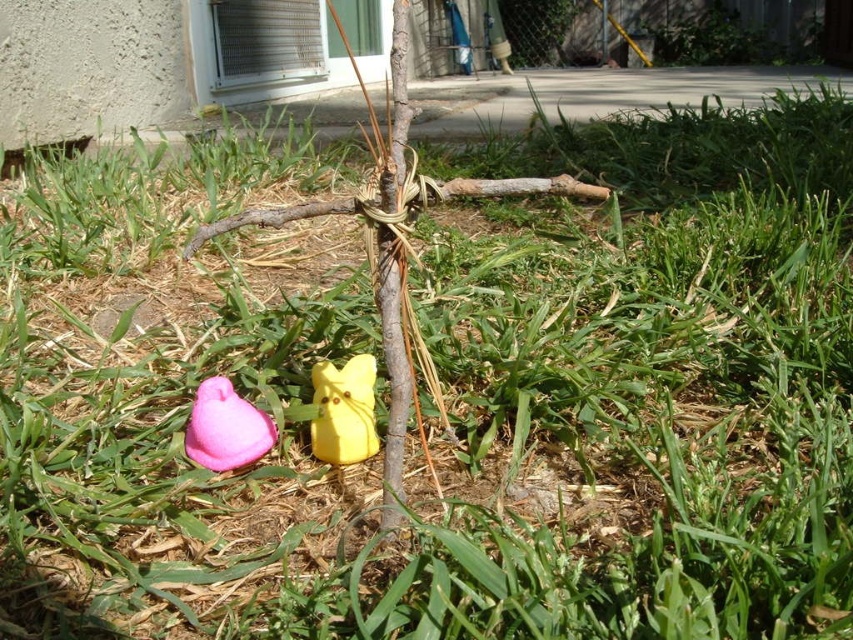
Measure the distance between yellow matte plush at center and camera.

The distance of yellow matte plush at center from camera is 1.26 meters.

Where is `yellow matte plush at center`? The image size is (853, 640). yellow matte plush at center is located at coordinates (344, 410).